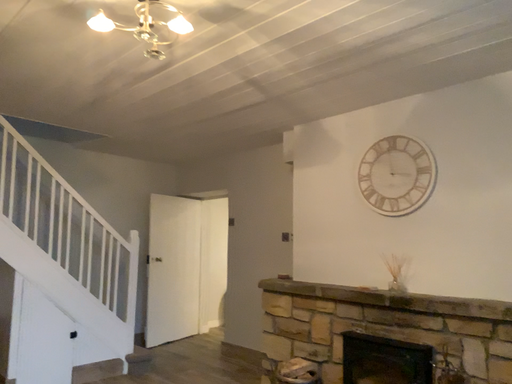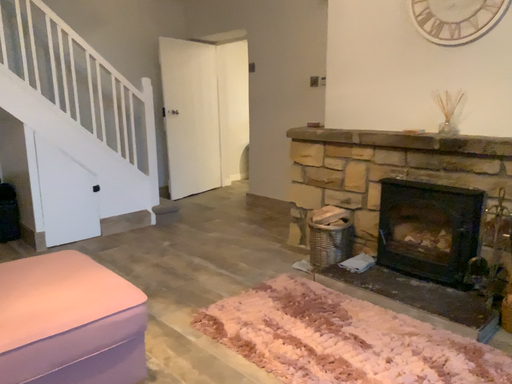
Question: Which way did the camera rotate in the video?

Choices:
 (A) rotated upward
 (B) rotated downward

Answer: (B)